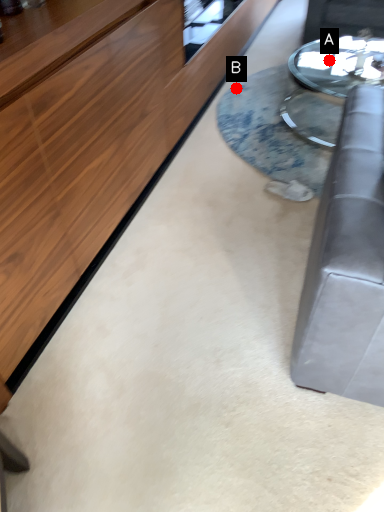
Question: Two points are circled on the image, labeled by A and B beside each circle. Which point is further to the camera?

Choices:
 (A) A is further
 (B) B is further

Answer: (B)